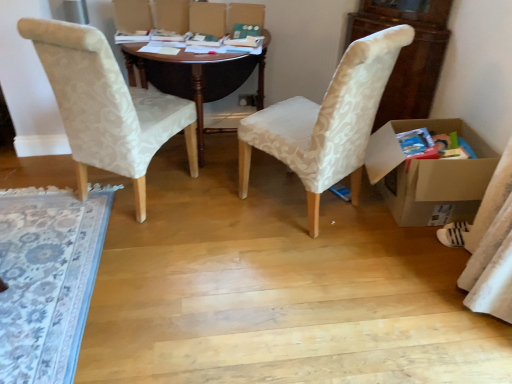
Question: Considering the relative sizes of white fabric sock at lower right and matte beige fabric chair at center, marked as the 1th chair in a right-to-left arrangement, in the image provided, is white fabric sock at lower right shorter than matte beige fabric chair at center, marked as the 1th chair in a right-to-left arrangement,?

Choices:
 (A) yes
 (B) no

Answer: (A)

Question: From the image's perspective, is white fabric sock at lower right on top of matte beige fabric chair at center, marked as the 1th chair in a right-to-left arrangement?

Choices:
 (A) no
 (B) yes

Answer: (A)

Question: From a real-world perspective, is white fabric sock at lower right located higher than matte beige fabric chair at center, marked as the second chair in a left-to-right arrangement?

Choices:
 (A) yes
 (B) no

Answer: (B)

Question: Is white fabric sock at lower right not inside matte beige fabric chair at center, marked as the second chair in a left-to-right arrangement?

Choices:
 (A) yes
 (B) no

Answer: (A)

Question: Considering the relative sizes of white fabric sock at lower right and matte beige fabric chair at center, marked as the 1th chair in a right-to-left arrangement, in the image provided, is white fabric sock at lower right taller than matte beige fabric chair at center, marked as the 1th chair in a right-to-left arrangement,?

Choices:
 (A) yes
 (B) no

Answer: (B)

Question: Is matte white fabric chair at left, marked as the first chair in a left-to-right arrangement, bigger or smaller than dark wood desk at center?

Choices:
 (A) small
 (B) big

Answer: (A)

Question: In the image, is matte white fabric chair at left, marked as the first chair in a left-to-right arrangement, positioned in front of or behind dark wood desk at center?

Choices:
 (A) behind
 (B) front

Answer: (B)

Question: Considering the positions of matte white fabric chair at left, which is counted as the 2th chair, starting from the right, and dark wood desk at center in the image, is matte white fabric chair at left, which is counted as the 2th chair, starting from the right, wider or thinner than dark wood desk at center?

Choices:
 (A) wide
 (B) thin

Answer: (B)

Question: Is matte white fabric chair at left, which is counted as the 2th chair, starting from the right, to the left or to the right of dark wood desk at center in the image?

Choices:
 (A) left
 (B) right

Answer: (A)

Question: Is cardboard box at right spatially inside white fabric sock at lower right, or outside of it?

Choices:
 (A) inside
 (B) outside

Answer: (B)

Question: Relative to white fabric sock at lower right, is cardboard box at right in front or behind?

Choices:
 (A) behind
 (B) front

Answer: (B)

Question: In terms of size, does cardboard box at right appear bigger or smaller than white fabric sock at lower right?

Choices:
 (A) big
 (B) small

Answer: (A)

Question: From a real-world perspective, is cardboard box at right positioned above or below white fabric sock at lower right?

Choices:
 (A) below
 (B) above

Answer: (B)

Question: Based on their sizes in the image, would you say dark wood desk at center is bigger or smaller than matte white fabric chair at left, marked as the first chair in a left-to-right arrangement?

Choices:
 (A) small
 (B) big

Answer: (B)

Question: Relative to matte white fabric chair at left, which is counted as the 2th chair, starting from the right, is dark wood desk at center in front or behind?

Choices:
 (A) behind
 (B) front

Answer: (A)